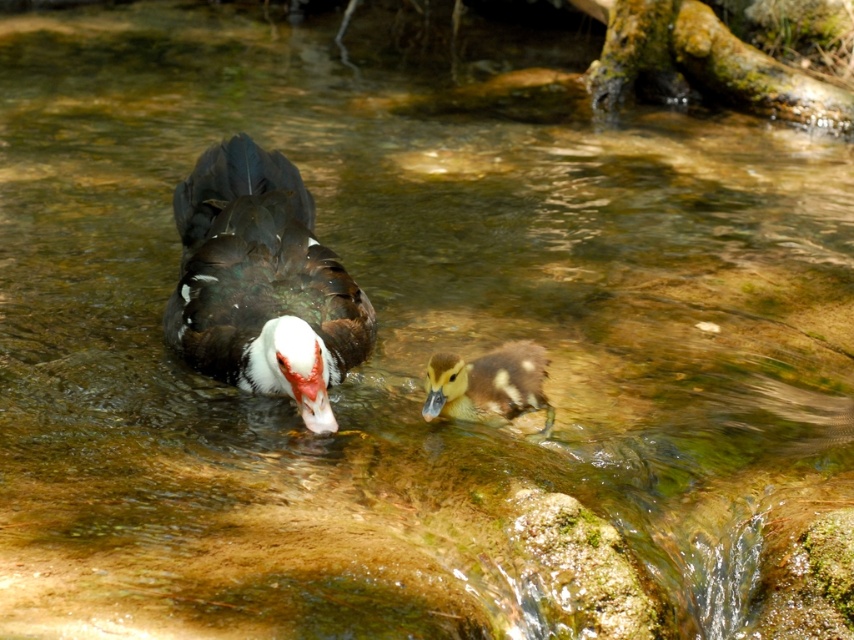
You are a photographer trying to capture both the black glossy duck at center and the brown speckled duckling at center in a single frame. Based on their sizes, which duck should you focus on to ensure both fit in the photo without cropping?

The black glossy duck at center might be wider than the brown speckled duckling at center, so focusing on the larger duck ensures both fit in the photo without cropping.

You are a wildlife photographer aiming to capture a closeup shot of the black glossy duck at center and the brown speckled duckling at center. If your camera lens can only focus on objects taller than 15 centimeters, will both ducks be in focus?

The black glossy duck at center has a greater height compared to brown speckled duckling at center. Since the black glossy duck at center is taller than 15 centimeters, it will be in focus. However, the brown speckled duckling at center may not meet the height requirement, so it might be out of focus.

In the scene shown: You are a wildlife photographer aiming to capture a closeup of the black glossy duck at center and the brown speckled duckling at center. Since you want to focus on the duckling, which duck should you zoom in on more to ensure the duckling is the main subject?

The black glossy duck at center is larger in size than the brown speckled duckling at center, so to make the duckling the main subject, you should zoom in more on the brown speckled duckling at center to compensate for its smaller size.